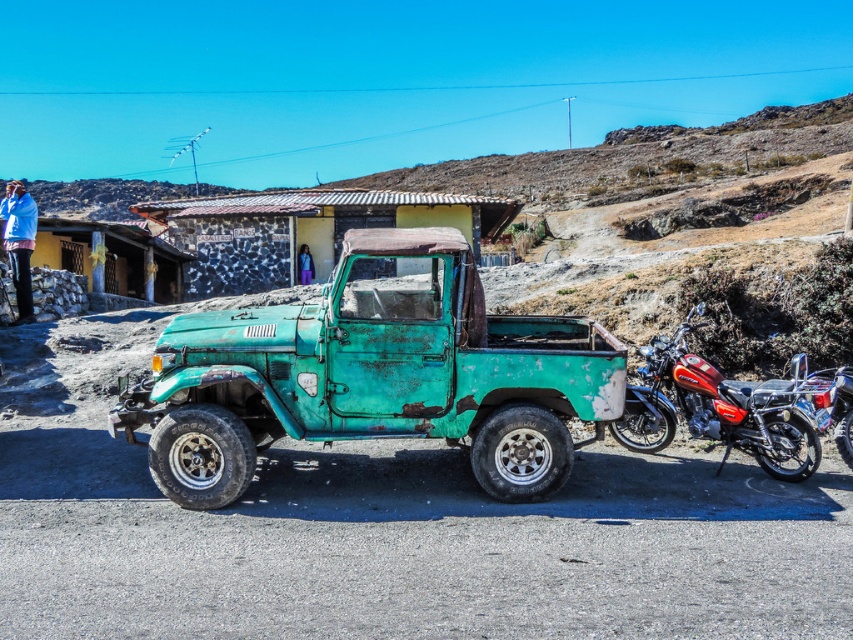
You are standing at the origin point in the image. Which direction should you move to reach the rusty teal truck at center?

The rusty teal truck at center is located at point 0.586 on the x axis and 0.440 on the y axis. Since you are at the origin, you should move towards the right and forward to reach it.

You are a delivery person needing to access the blue fabric jacket at upper left. The shiny red motorcycle at right is blocking your path. Can you move the motorcycle to reach the jacket?

The shiny red motorcycle at right is in front of the blue fabric jacket at upper left, so moving the motorcycle would allow access to the jacket.